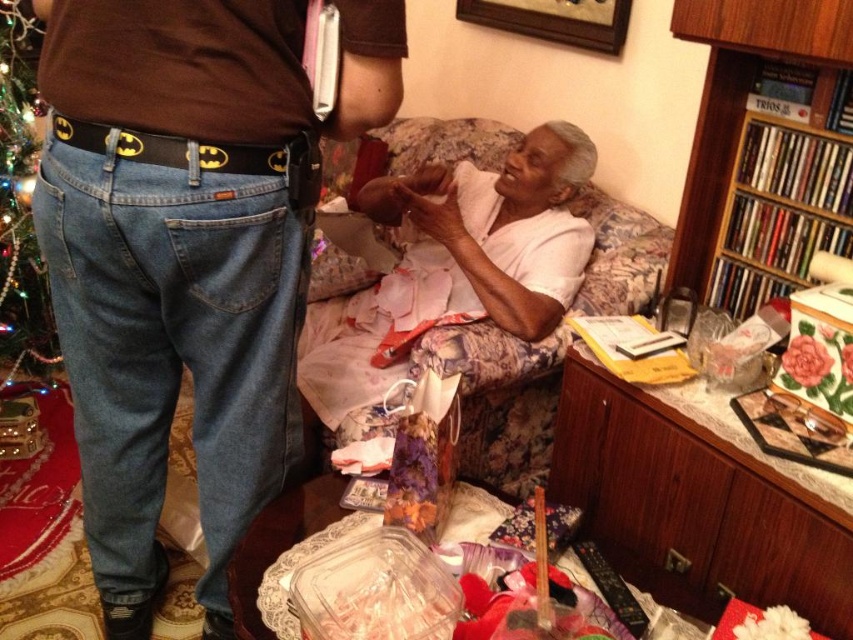
Does floral fabric couch at center have a greater height compared to wooden bookshelf at right?

Yes, floral fabric couch at center is taller than wooden bookshelf at right.

Can you confirm if floral fabric couch at center is thinner than wooden bookshelf at right?

No.

Does point (468, 408) come closer to viewer compared to point (828, 132)?

No, it is not.

Image resolution: width=853 pixels, height=640 pixels. In order to click on floral fabric couch at center in this screenshot , I will do `click(428, 362)`.

Is wooden bookshelf at right bigger than green beaded christmas tree at left?

No.

Which is in front, point (766, 186) or point (44, 296)?

Point (766, 186) is more forward.

Find the location of a particular element. Image resolution: width=853 pixels, height=640 pixels. wooden bookshelf at right is located at coordinates click(x=776, y=209).

Which is more to the left, denim jeans at center or floral fabric couch at center?

From the viewer's perspective, denim jeans at center appears more on the left side.

This screenshot has width=853, height=640. In order to click on denim jeans at center in this screenshot , I will do `click(187, 253)`.